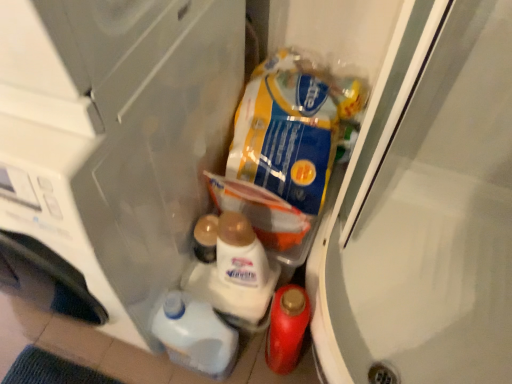
Question: Considering the positions of transparent plastic screen door at upper right and transparent plastic container at lower center in the image, is transparent plastic screen door at upper right wider or thinner than transparent plastic container at lower center?

Choices:
 (A) wide
 (B) thin

Answer: (B)

Question: In the image, is transparent plastic screen door at upper right positioned in front of or behind transparent plastic container at lower center?

Choices:
 (A) front
 (B) behind

Answer: (B)

Question: Which is farther from the transparent plastic container at lower center?

Choices:
 (A) blue/yellow plastic bag at upper right, the first snack from the top
 (B) white glossy lotion at center, the second snack from the top
 (C) white glossy liquid at lower center, placed as the third snack when sorted from top to bottom
 (D) transparent plastic screen door at upper right
 (E) matte plastic bottle at lower right

Answer: (D)

Question: Estimate the real-world distances between objects in this image. Which object is closer to the transparent plastic container at lower center?

Choices:
 (A) blue/yellow plastic bag at upper right, which is the 3th snack in bottom-to-top order
 (B) white glossy liquid at lower center, placed as the third snack when sorted from top to bottom
 (C) matte plastic bottle at lower right
 (D) transparent plastic screen door at upper right
 (E) white glossy lotion at center, which is counted as the second snack, starting from the bottom

Answer: (E)